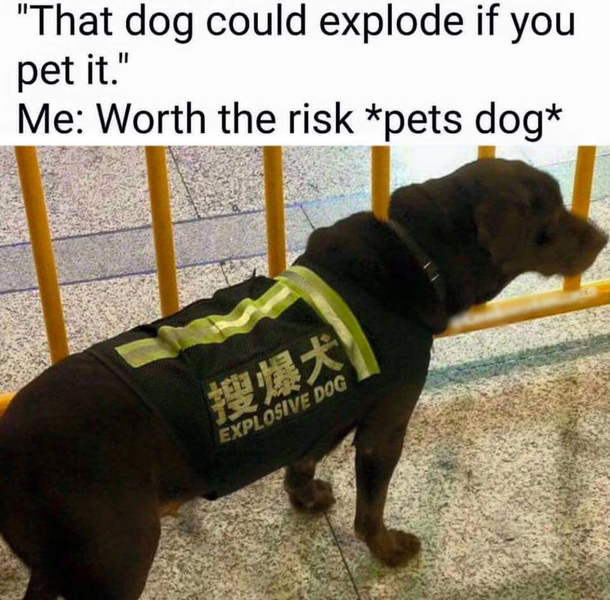
Locate an element on the screen. tile floor is located at coordinates (511, 455).